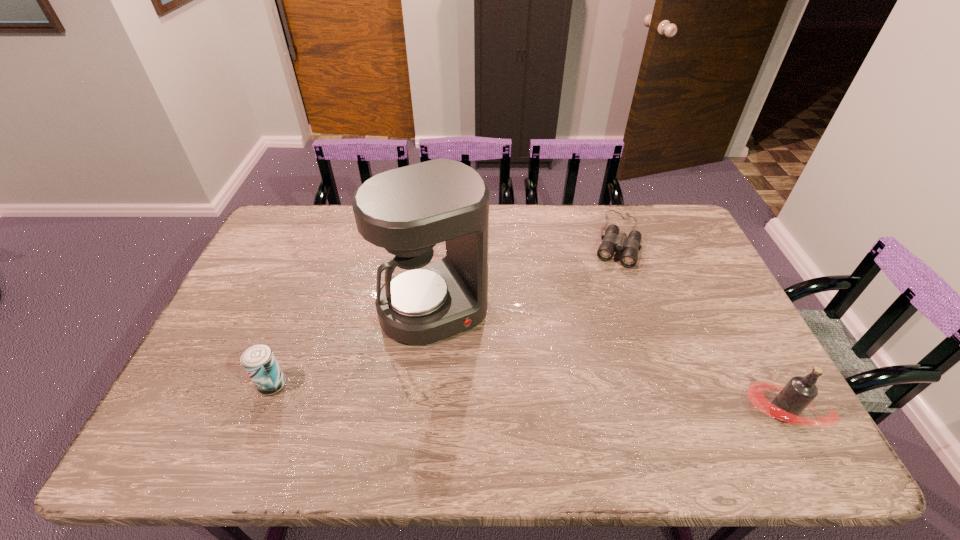
You are a GUI agent. You are given a task and a screenshot of the screen. Output one action in this format:
    pyautogui.click(x=<x>, y=<y>)
    Task: Click on the vacant spot on the desktop that is between the second shortest object and the rightmost object and is positioned at the eyepiece of the farthest object
    The width and height of the screenshot is (960, 540).
    Given the screenshot: What is the action you would take?
    pyautogui.click(x=565, y=401)

Identify the location of vacant spot on the desktop that is between the leftmost object and the root beer and is positioned on the front-facing side of the coffee maker. (485, 396).